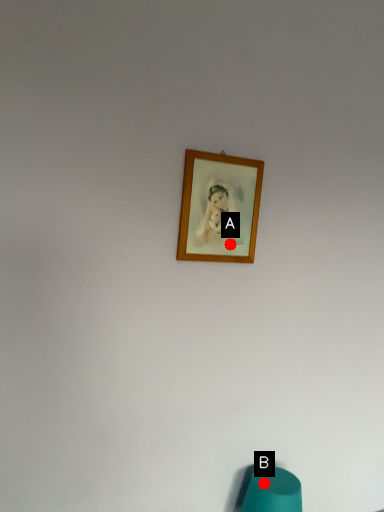
Question: Two points are circled on the image, labeled by A and B beside each circle. Which point is further to the camera?

Choices:
 (A) A is further
 (B) B is further

Answer: (B)